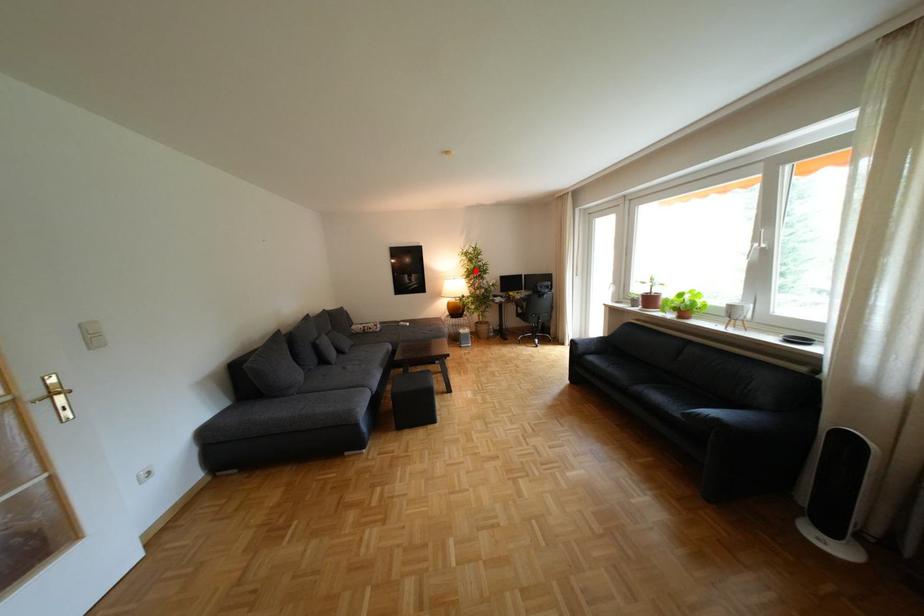
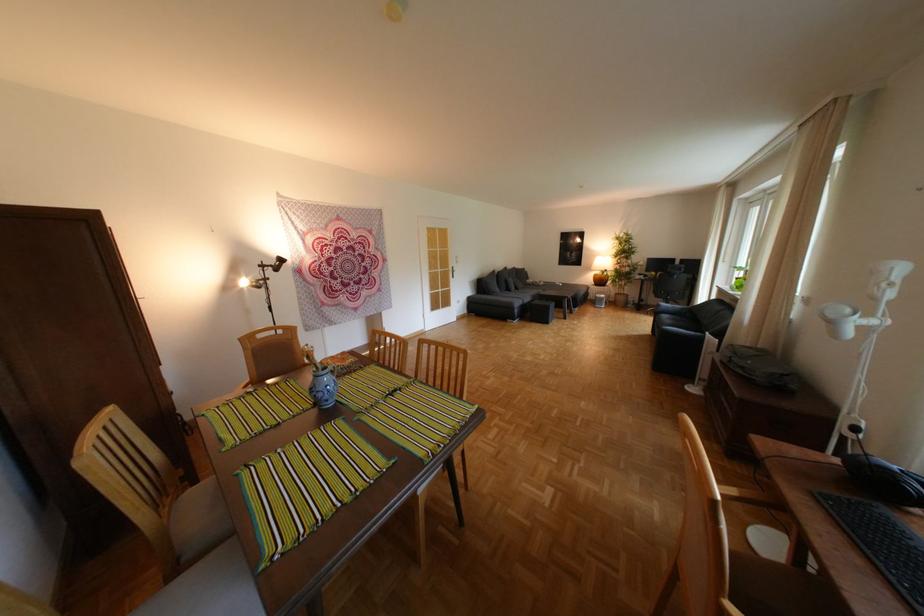
The point at the highlighted location is marked in the first image. Where is the corresponding point in the second image?

(626, 252)